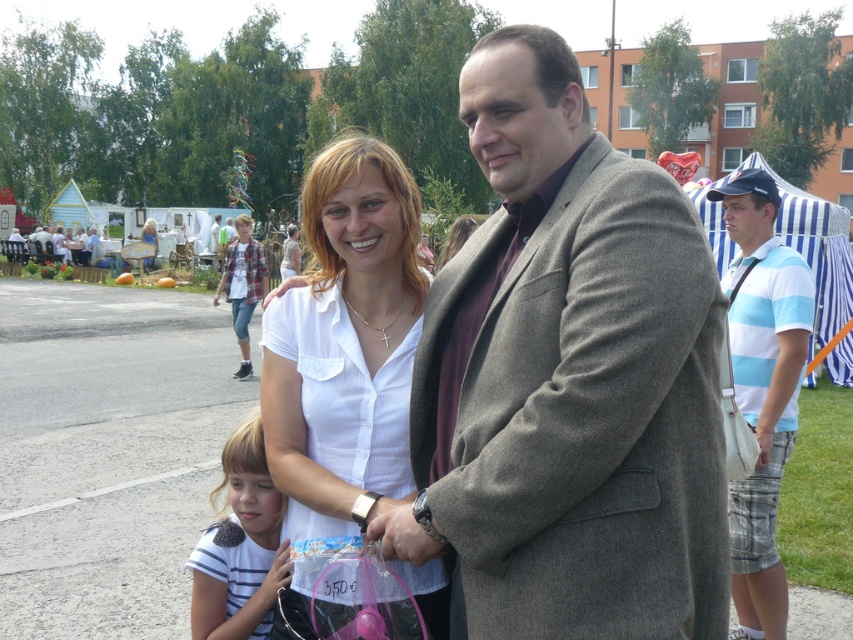
Does point (485, 224) come closer to viewer compared to point (250, 496)?

Yes, it is in front of point (250, 496).

This screenshot has height=640, width=853. I want to click on matte brown coat at center, so click(x=567, y=380).

Between matte brown coat at center and white smooth shirt at center, which one has more height?

matte brown coat at center

Locate an element on the screen. matte brown coat at center is located at coordinates (567, 380).

Which is behind, point (759, 481) or point (223, 484)?

Positioned behind is point (759, 481).

Does blue striped shirt at right appear on the left side of white striped shirt at center?

No, blue striped shirt at right is not to the left of white striped shirt at center.

Identify the location of blue striped shirt at right. Image resolution: width=853 pixels, height=640 pixels. (762, 388).

Locate an element on the screen. blue striped shirt at right is located at coordinates (762, 388).